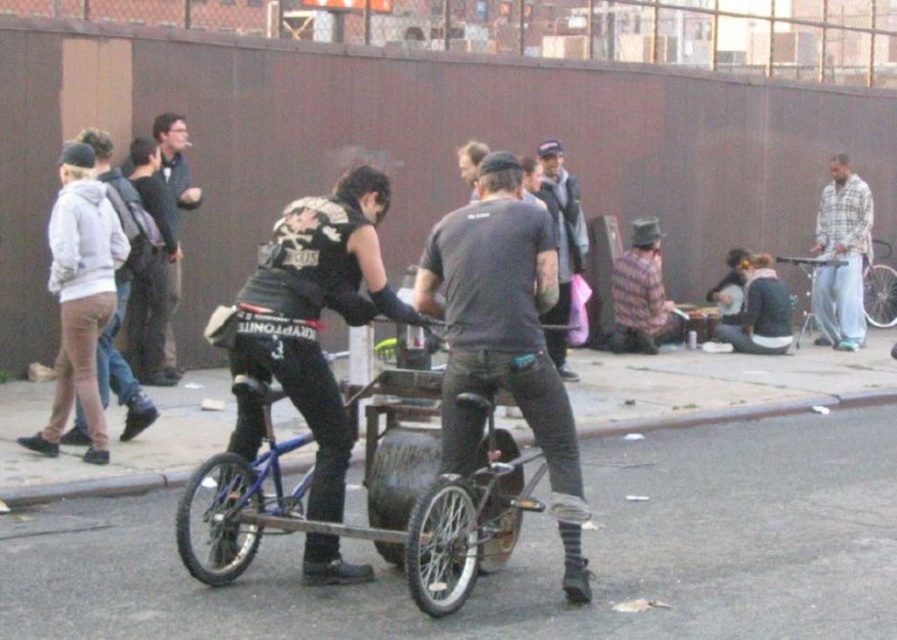
Question: Can you confirm if black leather vest at center is positioned to the right of blue metallic bicycle at right?

Choices:
 (A) yes
 (B) no

Answer: (B)

Question: Is smooth asphalt road at center bigger than plaid flannel shirt at right?

Choices:
 (A) yes
 (B) no

Answer: (B)

Question: Which point is farther from the camera taking this photo?

Choices:
 (A) coord(177,230)
 (B) coord(834,342)

Answer: (B)

Question: Where is dark gray hoodie at center located in relation to blue metallic bicycle at right in the image?

Choices:
 (A) left
 (B) right

Answer: (A)

Question: Which of the following is the closest to the observer?

Choices:
 (A) dark gray t-shirt at center
 (B) black leather vest at center

Answer: (A)

Question: Which of the following is the farthest from the observer?

Choices:
 (A) dark gray hoodie at center
 (B) blue metallic bicycle at right
 (C) black leather vest at center
 (D) plaid flannel shirt at right

Answer: (B)